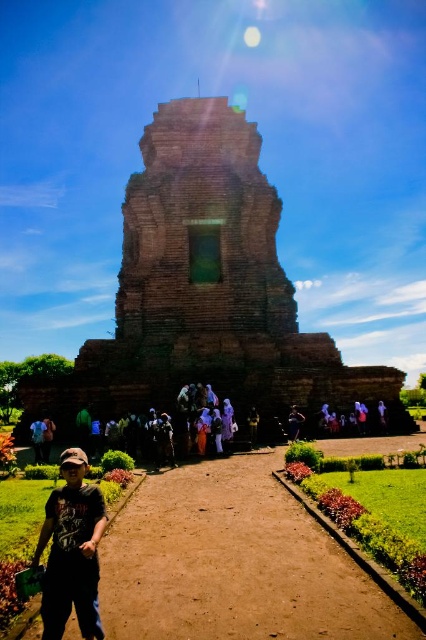
Does dark gray fabric cap at lower left appear over blue denim jeans at lower left?

Actually, dark gray fabric cap at lower left is below blue denim jeans at lower left.

Which is below, dark gray fabric cap at lower left or blue denim jeans at lower left?

dark gray fabric cap at lower left is lower down.

Who is more forward, [97,616] or [45,436]?

Point [97,616] is more forward.

You are a GUI agent. You are given a task and a screenshot of the screen. Output one action in this format:
    pyautogui.click(x=<x>, y=<y>)
    Task: Click on the dark gray fabric cap at lower left
    The width and height of the screenshot is (426, 640).
    Given the screenshot: What is the action you would take?
    pyautogui.click(x=71, y=550)

Image resolution: width=426 pixels, height=640 pixels. Describe the element at coordinates (48, 436) in the screenshot. I see `blue denim jeans at lower left` at that location.

Who is more forward, (43, 440) or (290, 440)?

Point (43, 440) is in front.

In order to click on blue denim jeans at lower left in this screenshot , I will do `click(48, 436)`.

Between dark gray fabric cap at lower left and brown fabric tourist at center, which one has less height?

With less height is brown fabric tourist at center.

Which is in front, point (66, 509) or point (258, 420)?

Point (66, 509) is in front.

What do you see at coordinates (71, 550) in the screenshot? I see `dark gray fabric cap at lower left` at bounding box center [71, 550].

Find the location of a particular element. The width and height of the screenshot is (426, 640). dark gray fabric cap at lower left is located at coordinates (71, 550).